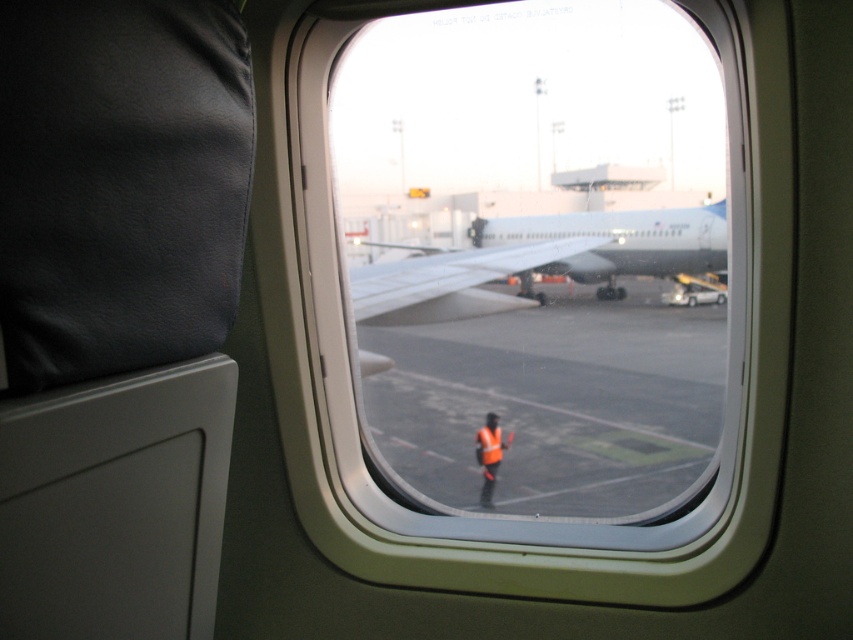
From the picture: Does white matte airplane at center lie in front of reflective orange vest at center?

No, it is behind reflective orange vest at center.

Who is more forward, (486,243) or (474,442)?

Point (474,442) is more forward.

The height and width of the screenshot is (640, 853). Identify the location of white matte airplane at center. (619, 243).

Can you confirm if transparent glass airplane window at center is positioned to the right of white matte airplane at center?

In fact, transparent glass airplane window at center is to the left of white matte airplane at center.

Is transparent glass airplane window at center above white matte airplane at center?

No.

You are a GUI agent. You are given a task and a screenshot of the screen. Output one action in this format:
    pyautogui.click(x=<x>, y=<y>)
    Task: Click on the transparent glass airplane window at center
    
    Given the screenshot: What is the action you would take?
    pyautogui.click(x=527, y=260)

From the picture: Between transparent glass airplane window at center and reflective orange safety vest at center, which one appears on the left side from the viewer's perspective?

transparent glass airplane window at center is more to the left.

Who is higher up, transparent glass airplane window at center or reflective orange safety vest at center?

transparent glass airplane window at center

Locate an element on the screen. transparent glass airplane window at center is located at coordinates (527, 260).